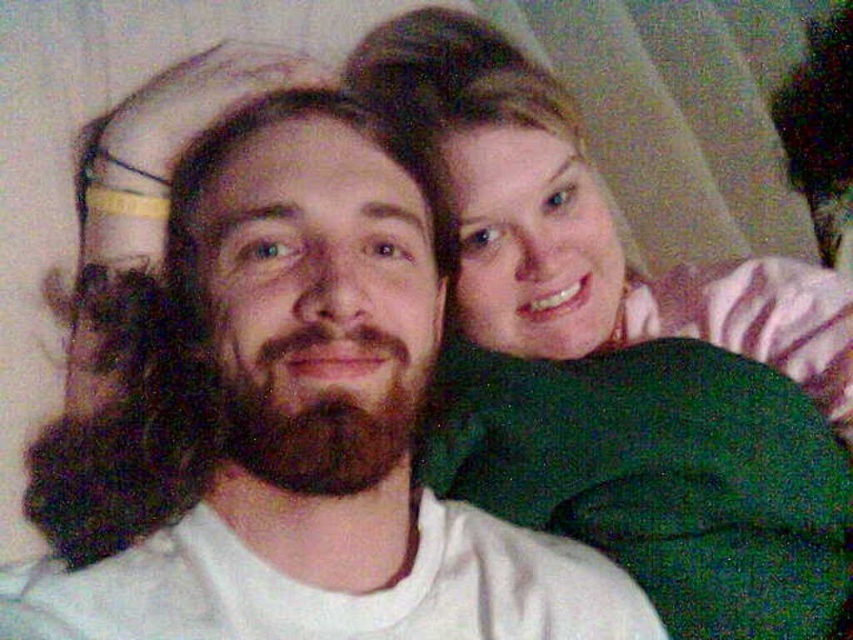
Which is behind, point (473, 298) or point (293, 392)?

Point (473, 298)

Does point (585, 189) lie in front of point (260, 378)?

No, it is behind (260, 378).

What do you see at coordinates (573, 220) in the screenshot?
I see `matte green sweater at upper right` at bounding box center [573, 220].

The image size is (853, 640). Find the location of `matte green sweater at upper right`. matte green sweater at upper right is located at coordinates (573, 220).